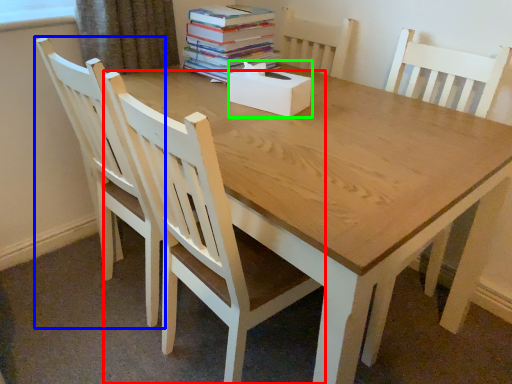
Question: Considering the real-world distances, which object is farthest from chair (highlighted by a red box)? chair (highlighted by a blue box) or box (highlighted by a green box)?

Choices:
 (A) chair
 (B) box

Answer: (B)